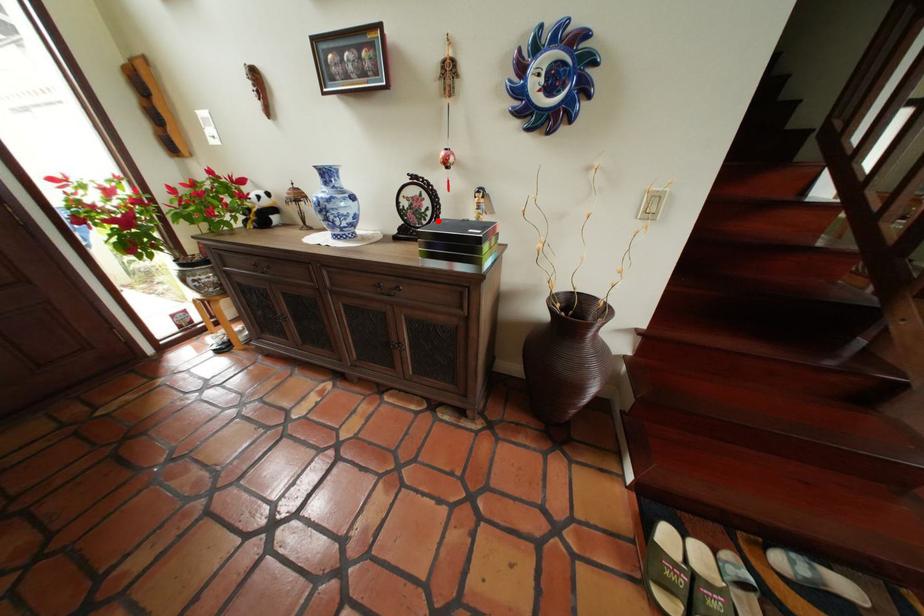
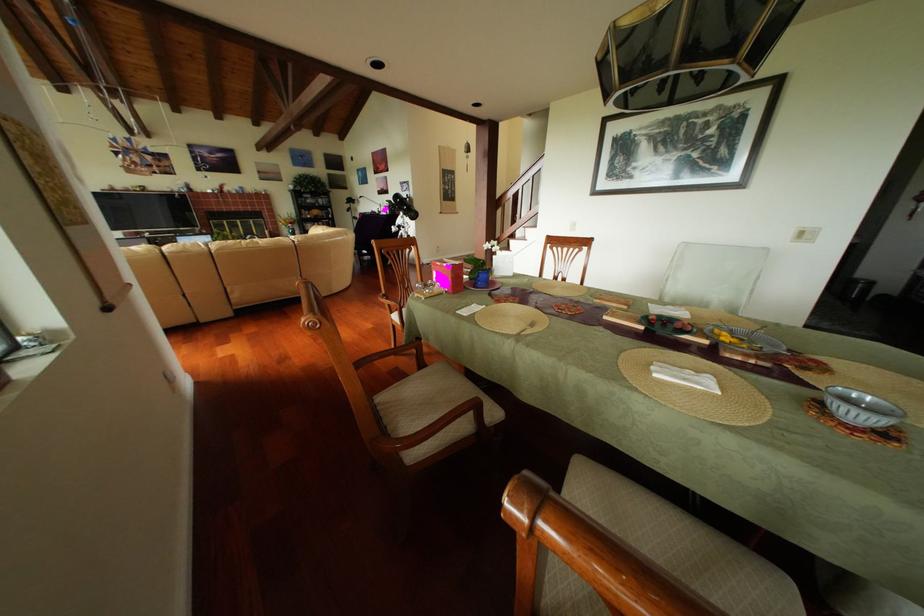
Question: I am providing you with two images of the same scene from different viewpoints. A red point is marked on the first image. Is the red point's position out of view in image 2?

Choices:
 (A) Yes
 (B) No

Answer: (A)